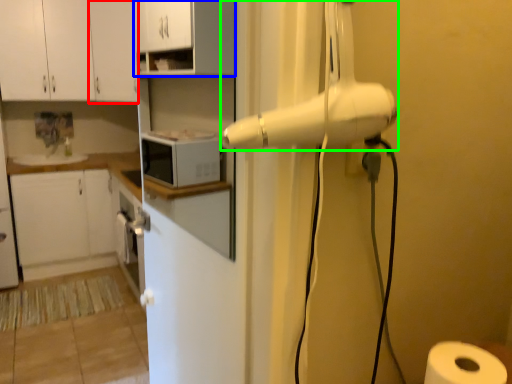
Question: Which object is the farthest from cabinetry (highlighted by a red box)? Choose among these: cabinetry (highlighted by a blue box) or home appliance (highlighted by a green box).

Choices:
 (A) cabinetry
 (B) home appliance

Answer: (B)